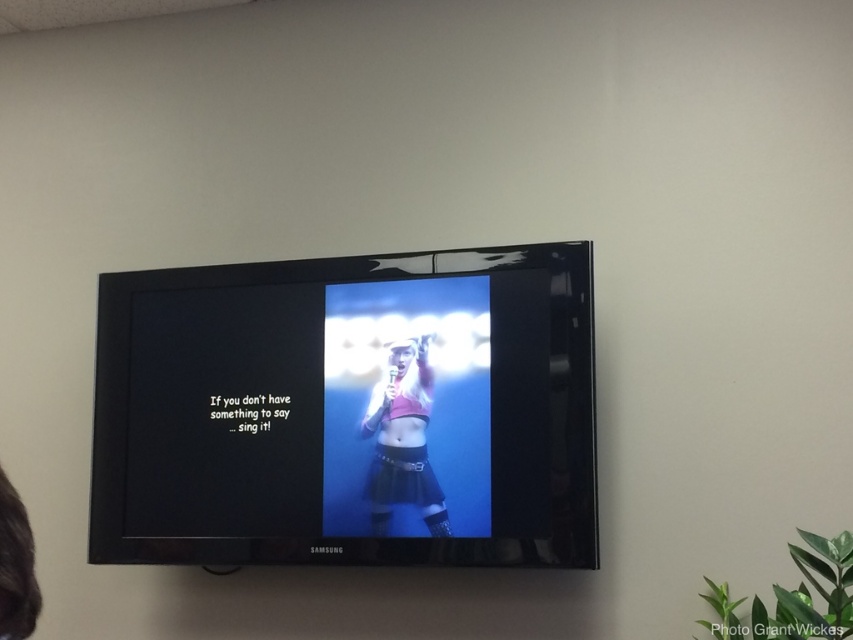
You are an interior designer planning to place a decorative item between the matte black tv at center and the matte pink top at center. Since the TV is wider than the top, where should you position the item to ensure it is centered between them?

Since the matte black tv at center is wider than the matte pink top at center, you should position the decorative item closer to the matte black tv at center to maintain a centered appearance between both objects.

You are standing in front of a Samsung television mounted on a beige wall. You see a point at coordinate (347, 410). What object is located at that point?

The point at coordinate (347, 410) corresponds to the matte black TV at center.

You are trying to determine which object in the scene is bigger. You see the matte black tv at center and the matte pink top at center. Which one has a bigger size?

The matte black tv at center has a larger size compared to the matte pink top at center.